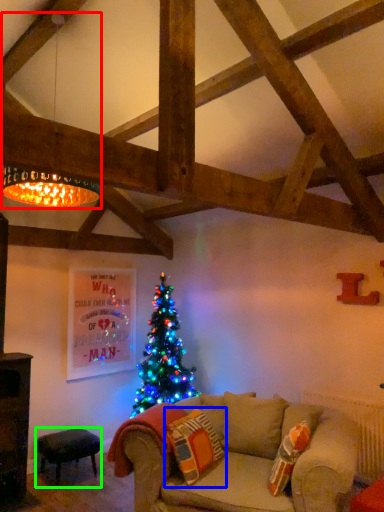
Question: Considering the real-world distances, which object is closest to lamp (highlighted by a red box)? pillow (highlighted by a blue box) or stool (highlighted by a green box).

Choices:
 (A) pillow
 (B) stool

Answer: (A)